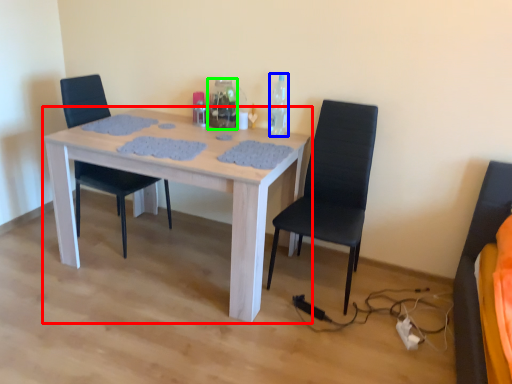
Question: Considering the real-world distances, which object is closest to kitchen & dining room table (highlighted by a red box)? bottle (highlighted by a blue box) or bottle (highlighted by a green box).

Choices:
 (A) bottle
 (B) bottle

Answer: (B)